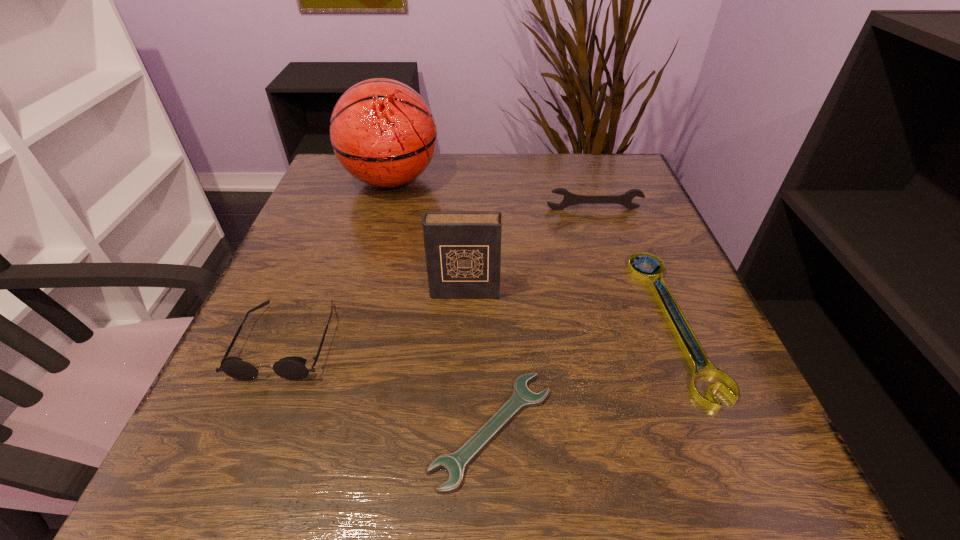
This screenshot has width=960, height=540. Find the location of `vacant space located 0.240m on the front cover of the diary`. vacant space located 0.240m on the front cover of the diary is located at coordinates (459, 421).

The width and height of the screenshot is (960, 540). I want to click on free spot located on the open ends of the farthest wrench, so point(601,232).

Identify the location of free location located 0.050m on the front-facing side of the sunglasses. (258, 412).

Where is `vacant space located on the left of the second shortest wrench`? The width and height of the screenshot is (960, 540). vacant space located on the left of the second shortest wrench is located at coordinates (490, 322).

Find the location of a particular element. The width and height of the screenshot is (960, 540). vacant space situated 0.230m on the back of the leftmost wrench is located at coordinates (489, 275).

What are the coordinates of `object situated at the far edge` in the screenshot? It's located at (383, 133).

This screenshot has width=960, height=540. I want to click on object located in the near edge section of the desktop, so click(x=454, y=464).

Locate an element on the screen. basketball located at the left edge is located at coordinates (383, 133).

Locate an element on the screen. sunglasses at the left edge is located at coordinates (292, 368).

At what (x,y) coordinates should I click in order to perform the action: click on object at the far left corner. Please return your answer as a coordinate pair (x, y). Looking at the image, I should click on (383, 133).